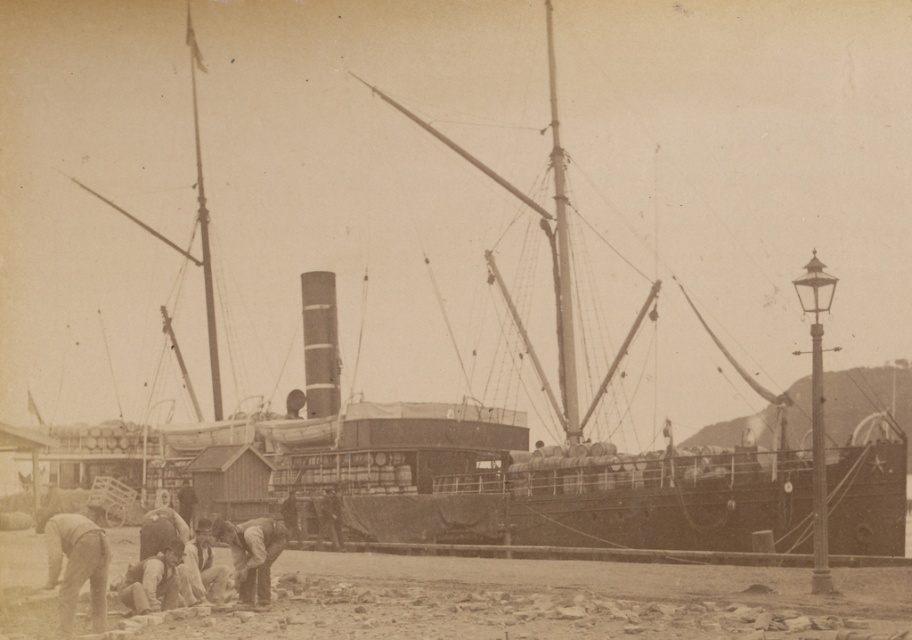
Is smooth wood mast at center wider than smooth wood mast at upper left?

Incorrect, smooth wood mast at center's width does not surpass smooth wood mast at upper left's.

Is point (568, 259) positioned in front of point (197, 129)?

Yes, it is in front of point (197, 129).

At what (x,y) coordinates should I click in order to perform the action: click on smooth wood mast at center. Please return your answer as a coordinate pair (x, y). The height and width of the screenshot is (640, 912). Looking at the image, I should click on coord(561,253).

Who is more forward, (x=570, y=291) or (x=179, y=556)?

Point (x=179, y=556) is in front.

Identify the location of smooth wood mast at center. The width and height of the screenshot is (912, 640). (561, 253).

This screenshot has width=912, height=640. What are the coordinates of `smooth wood mast at center` in the screenshot? It's located at (561, 253).

The image size is (912, 640). What are the coordinates of `smooth beige pants at lower left` in the screenshot? It's located at (76, 564).

Who is more distant from viewer, (79, 579) or (251, 556)?

Positioned behind is point (251, 556).

Which is in front, point (78, 586) or point (264, 577)?

Point (78, 586) is in front.

Locate an element on the screen. This screenshot has width=912, height=640. smooth beige pants at lower left is located at coordinates (76, 564).